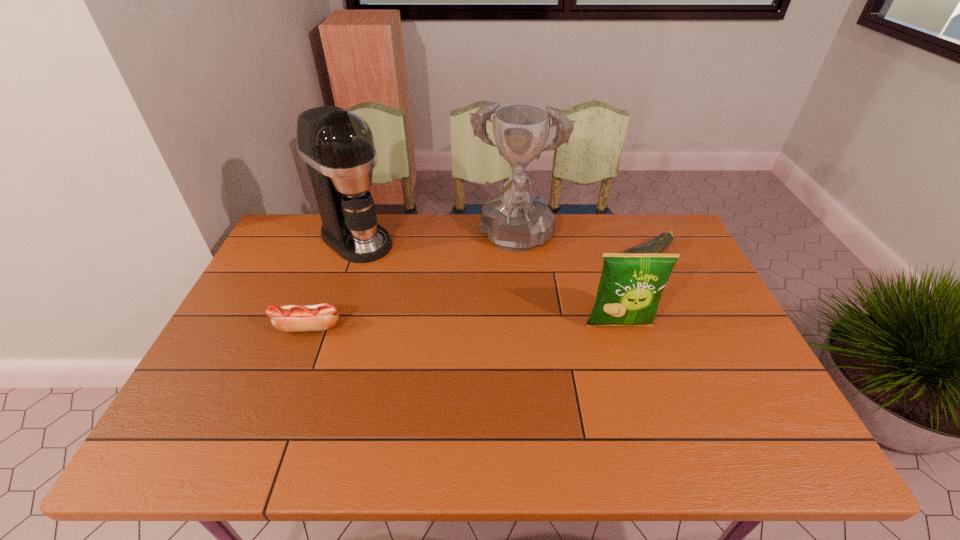
This screenshot has width=960, height=540. Find the location of `free space located at the blossom end of the zucchini`. free space located at the blossom end of the zucchini is located at coordinates (596, 280).

The image size is (960, 540). Find the location of `vacant region located 0.320m at the blossom end of the zucchini`. vacant region located 0.320m at the blossom end of the zucchini is located at coordinates (540, 307).

This screenshot has height=540, width=960. I want to click on free region located 0.190m at the blossom end of the zucchini, so click(576, 291).

At what (x,y) coordinates should I click in order to perform the action: click on vacant space located 0.220m on the side with emblem of the award. Please return your answer as a coordinate pair (x, y). This screenshot has width=960, height=540. Looking at the image, I should click on (497, 319).

You are a GUI agent. You are given a task and a screenshot of the screen. Output one action in this format:
    pyautogui.click(x=<x>, y=<y>)
    Task: Click on the free region located 0.350m on the side with emblem of the award
    This screenshot has height=540, width=960.
    Given the screenshot: What is the action you would take?
    pyautogui.click(x=490, y=356)

At what (x,y) coordinates should I click in order to perform the action: click on free space located 0.230m on the side with emblem of the award. Please return your answer as a coordinate pair (x, y). This screenshot has width=960, height=540. Looking at the image, I should click on (497, 321).

I want to click on coffee maker that is at the far edge, so click(337, 145).

In order to click on zucchini that is at the far edge in this screenshot , I will do `click(657, 245)`.

Locate an element on the screen. The height and width of the screenshot is (540, 960). award present at the far edge is located at coordinates (515, 222).

Identify the location of sausage at the left edge. (292, 318).